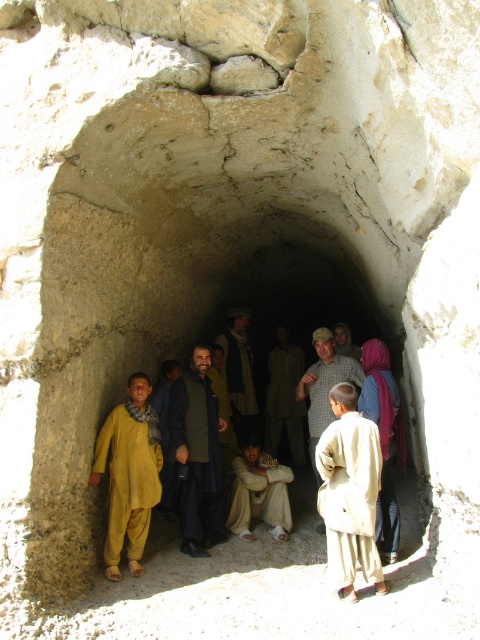
Between point (238, 493) and point (301, 387), which one is positioned behind?

The point (301, 387) is more distant.

Does light beige cotton robe at center appear on the left side of checkered fabric shirt at center?

Yes, light beige cotton robe at center is to the left of checkered fabric shirt at center.

This screenshot has height=640, width=480. In order to click on light beige cotton robe at center in this screenshot , I will do `click(259, 493)`.

Where is `light beige cotton robe at center`? The height and width of the screenshot is (640, 480). light beige cotton robe at center is located at coordinates (259, 493).

The height and width of the screenshot is (640, 480). Find the location of `dark green woolen coat at center`. dark green woolen coat at center is located at coordinates (197, 454).

Is dark green woolen coat at center closer to the viewer compared to dark brown woolen jacket at center?

Yes, it is in front of dark brown woolen jacket at center.

Between point (206, 524) and point (252, 417), which one is positioned in front?

Point (206, 524) is in front.

Locate an element on the screen. Image resolution: width=480 pixels, height=640 pixels. dark green woolen coat at center is located at coordinates (197, 454).

Is point (325, 532) farther from camera compared to point (115, 484)?

Yes, it is behind point (115, 484).

Is light beige fabric robe at center further to the viewer compared to yellow cotton robe at center?

No.

The image size is (480, 640). Identify the location of light beige fabric robe at center. (349, 497).

This screenshot has width=480, height=640. In order to click on light beige fabric robe at center in this screenshot , I will do [x=349, y=497].